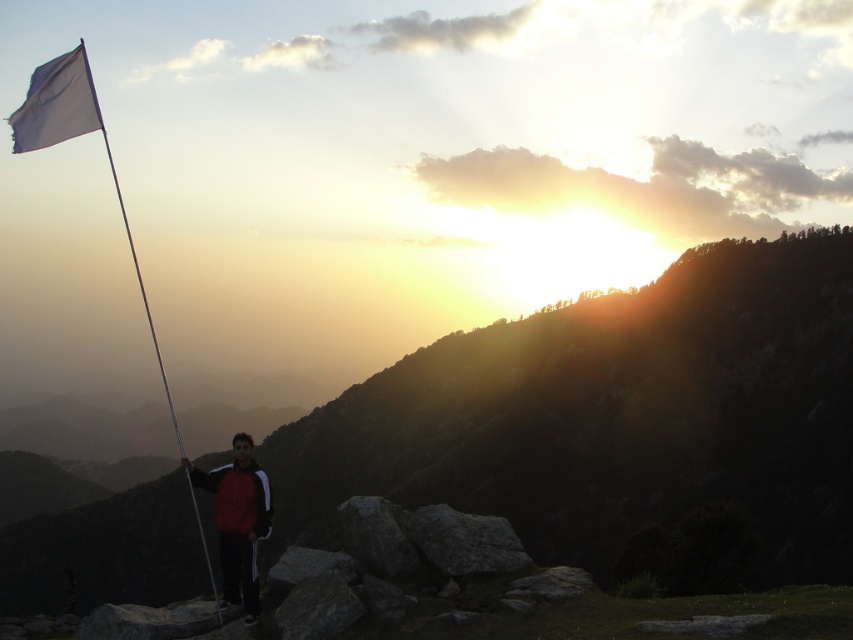
Is matte black flag at upper left shorter than white fabric flag at left?

Yes.

Is matte black flag at upper left above white fabric flag at left?

No.

Who is more distant from viewer, (633, 502) or (187, 476)?

The point (633, 502) is behind.

Where is `matte black flag at upper left`? matte black flag at upper left is located at coordinates (614, 417).

Which is more to the right, matte black flag at upper left or red jacket at center?

From the viewer's perspective, matte black flag at upper left appears more on the right side.

Between point (595, 540) and point (242, 532), which one is positioned in front?

Point (242, 532)

Between point (596, 388) and point (231, 557), which one is positioned behind?

The point (596, 388) is more distant.

Identify the location of matte black flag at upper left. This screenshot has height=640, width=853. coord(614,417).

Who is more forward, (265, 484) or (202, 554)?

Positioned in front is point (265, 484).

Between red jacket at center and white fabric flag at left, which one is positioned lower?

Positioned lower is red jacket at center.

Is point (241, 552) less distant than point (202, 531)?

Yes, point (241, 552) is closer to viewer.

This screenshot has height=640, width=853. I want to click on red jacket at center, so click(x=238, y=522).